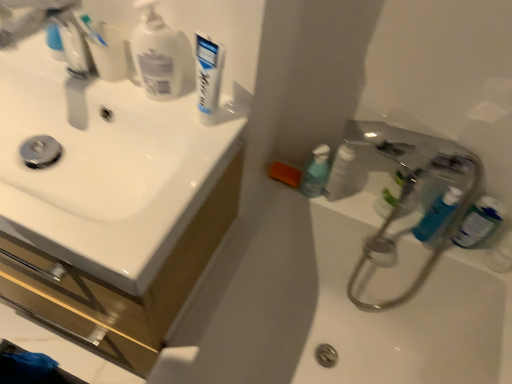
Find the location of a particular element. This screenshot has width=512, height=384. free point in front of white glossy toothpaste at upper center is located at coordinates (167, 185).